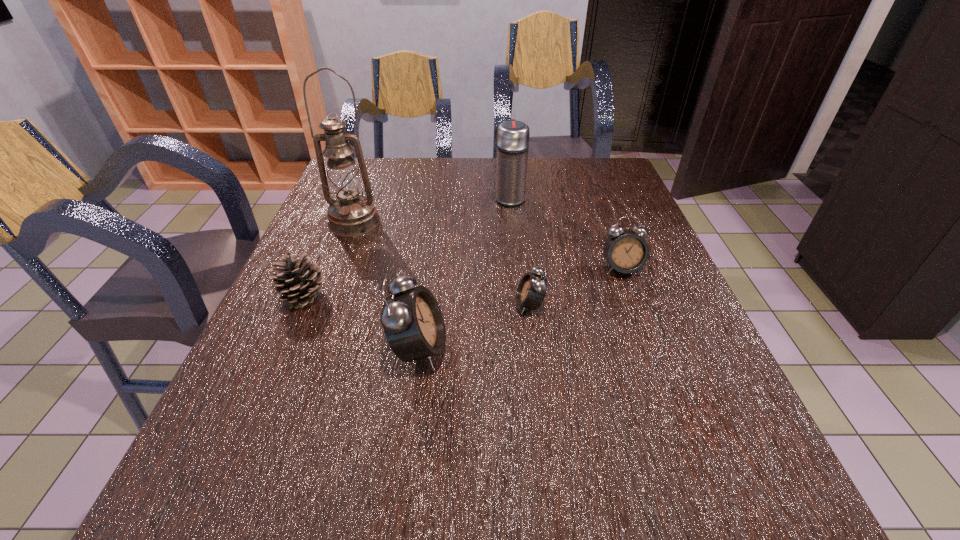
I want to click on the third closest object to the farthest alarm clock, so click(x=412, y=321).

Find the location of `object that is the fifth closest to the second tallest alarm clock`. object that is the fifth closest to the second tallest alarm clock is located at coordinates (299, 280).

This screenshot has height=540, width=960. I want to click on the closest alarm clock relative to the farthest alarm clock, so click(531, 291).

Where is `the second closest alarm clock to the second tallest object`? The image size is (960, 540). the second closest alarm clock to the second tallest object is located at coordinates (531, 291).

Locate an element on the screen. free space that satisfies the following two spatial constraints: 1. on the back side of the pinecone; 2. on the right side of the fifth nearest object is located at coordinates (336, 222).

Find the location of a particular element. The width and height of the screenshot is (960, 540). vacant region that satisfies the following two spatial constraints: 1. on the back side of the second farthest object; 2. on the left side of the pinecone is located at coordinates (336, 222).